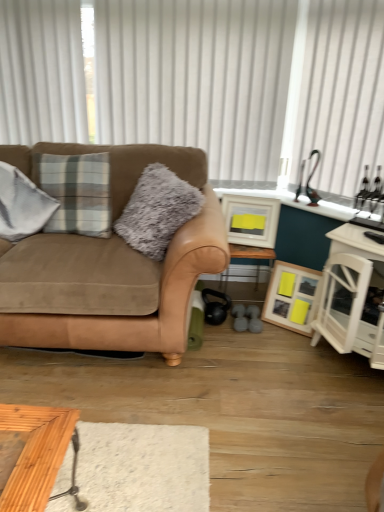
Question: Is white vertical blinds at upper center, which is the 2th curtain in right-to-left order, to the left or to the right of white wood cabinet at right in the image?

Choices:
 (A) right
 (B) left

Answer: (B)

Question: From the image's perspective, relative to white wood cabinet at right, is white vertical blinds at upper center, which appears as the first curtain when viewed from the left, above or below?

Choices:
 (A) below
 (B) above

Answer: (B)

Question: Considering the real-world distances, which object is farthest from the wooden table at center?

Choices:
 (A) fuzzy gray pillow at center
 (B) white wood cabinet at right
 (C) matte white picture frame at center, arranged as the second picture frame when ordered from the bottom
 (D) white sheer curtain at upper right, marked as the second curtain in a left-to-right arrangement
 (E) white vertical blinds at upper center, which is the 2th curtain in right-to-left order

Answer: (E)

Question: Which object is the closest to the fuzzy gray pillow at center?

Choices:
 (A) wooden picture frame at lower right, which is counted as the 1th picture frame, starting from the bottom
 (B) matte white picture frame at center, arranged as the first picture frame when viewed from the top
 (C) white vertical blinds at upper center, which appears as the first curtain when viewed from the left
 (D) suede brown couch at left
 (E) white sheer curtain at upper right, the first curtain when ordered from right to left

Answer: (D)